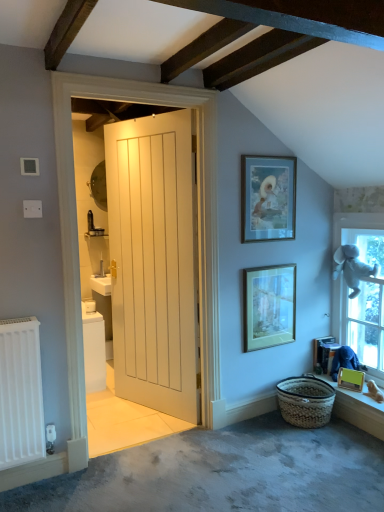
Locate an element on the screen. Image resolution: width=384 pixels, height=512 pixels. vacant region below white wooden door at center (from a real-world perspective) is located at coordinates (147, 409).